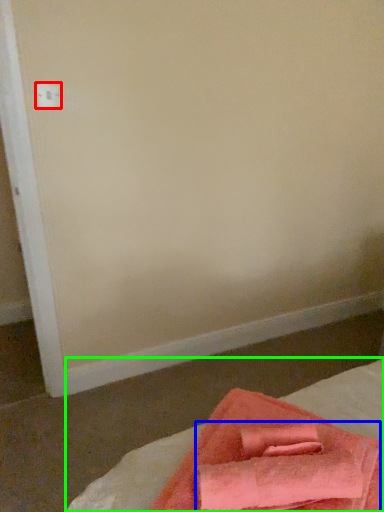
Question: Which object is positioned closest to electric outlet (highlighted by a red box)? Select from bath towel (highlighted by a blue box) and bed (highlighted by a green box).

Choices:
 (A) bath towel
 (B) bed

Answer: (B)